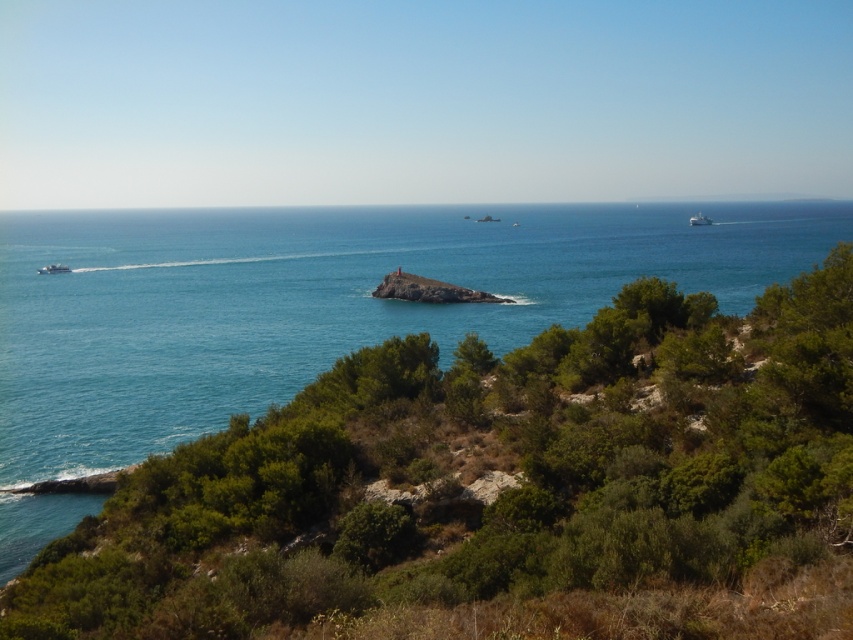
You are standing on the rocky shoreline and want to take a photo of the metallic silver boat at left and the blue water at center. Which object should you focus on first to ensure both are in the frame?

You should focus on the blue water at center first because it is in front of the metallic silver boat at left, so by focusing on the closer object, both will be in focus.

You are a photographer planning to capture the white matte boat at upper right and the blue water at center in a single frame. Based on their positions, which object will appear larger in your photo?

The blue water at center will appear larger in the photo since it is taller than the white matte boat at upper right.